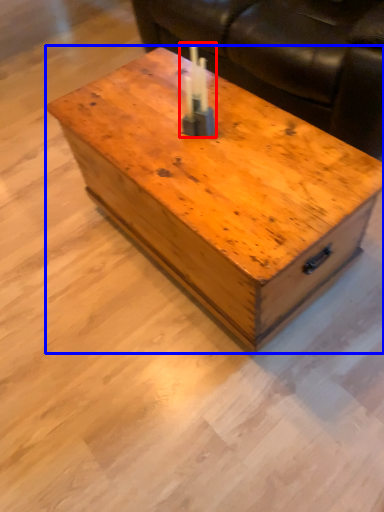
Question: Which of the following is the farthest to the observer, birthday candle (highlighted by a red box) or coffee table (highlighted by a blue box)?

Choices:
 (A) birthday candle
 (B) coffee table

Answer: (A)